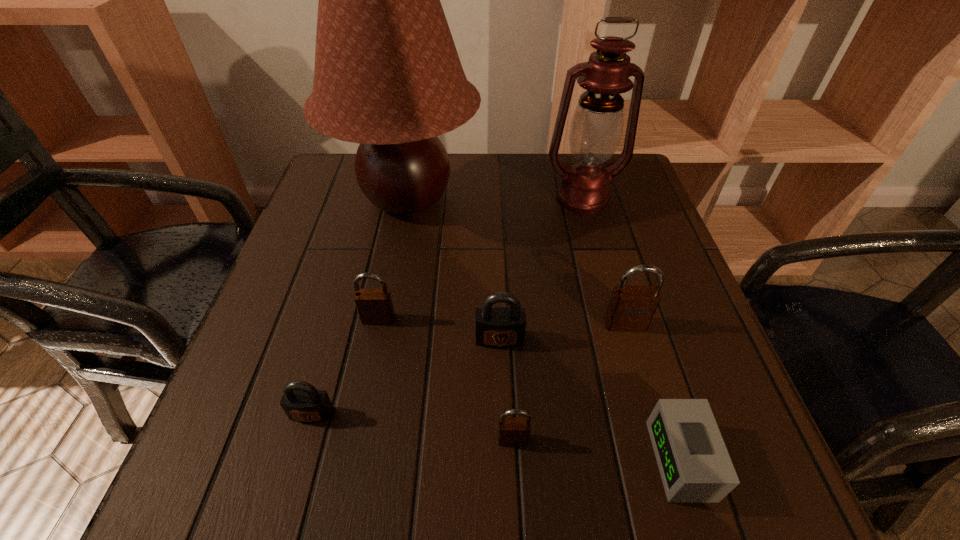
Identify the location of vacant space situated 0.060m on the front-facing side of the shortest object. The image size is (960, 540). (614, 460).

This screenshot has height=540, width=960. I want to click on free point located on the front-facing side of the shortest object, so [476, 460].

Where is `free space located on the front-facing side of the shortest object`? This screenshot has width=960, height=540. free space located on the front-facing side of the shortest object is located at coordinates (566, 460).

I want to click on lampshade present at the far edge, so click(387, 75).

The image size is (960, 540). Find the location of `oil lamp that is at the far edge`. oil lamp that is at the far edge is located at coordinates (596, 127).

Identify the location of padlock present at the near edge. The width and height of the screenshot is (960, 540). (512, 431).

Locate an element on the screen. This screenshot has width=960, height=540. alarm clock present at the near edge is located at coordinates (695, 467).

Where is `lampshade at the left edge`? Image resolution: width=960 pixels, height=540 pixels. lampshade at the left edge is located at coordinates (387, 75).

This screenshot has width=960, height=540. I want to click on padlock at the left edge, so (302, 402).

At what (x,y) coordinates should I click in order to perform the action: click on oil lamp present at the right edge. Please return your answer as a coordinate pair (x, y). Looking at the image, I should click on (596, 127).